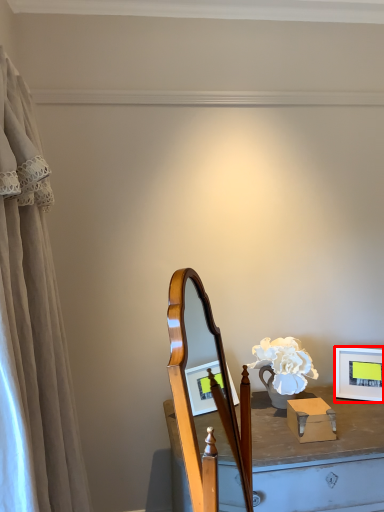
Question: Where is picture frame (annotated by the red box) located in relation to curtain in the image?

Choices:
 (A) left
 (B) right

Answer: (B)